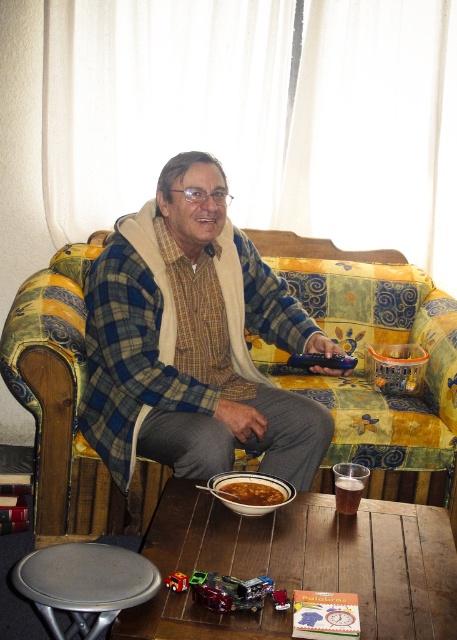
You are a guest in the living room and see the wooden table at center and the brown matte bowl at lower center. Which object is closer to you?

The wooden table at center is closer to you because it is in front of the brown matte bowl at lower center.

You are standing in the room and want to sit down on the yellow floral fabric couch at center. Based on its position, where should you walk to in order to reach it?

The yellow floral fabric couch at center is located at point (361, 378), so you should walk towards the coordinates (361, 378) to reach it.